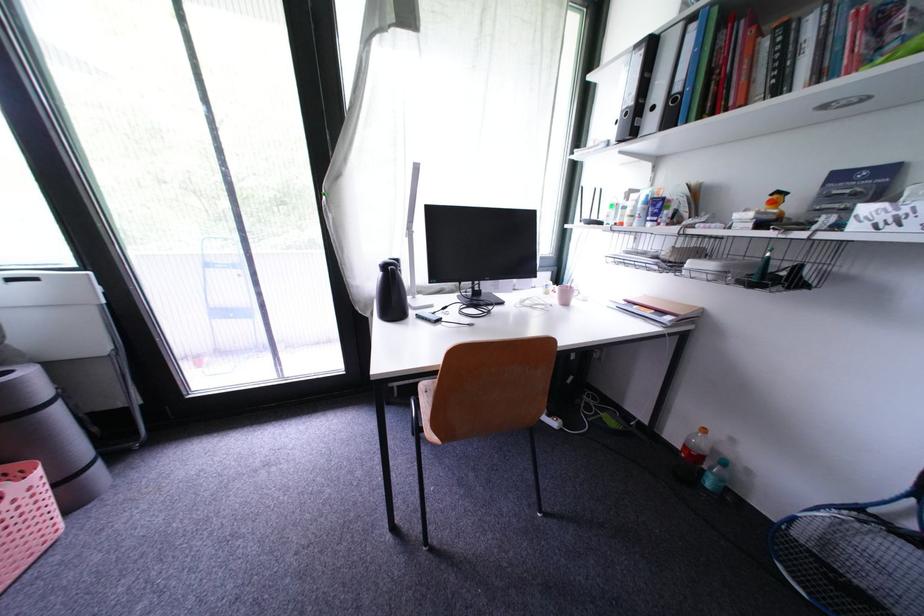
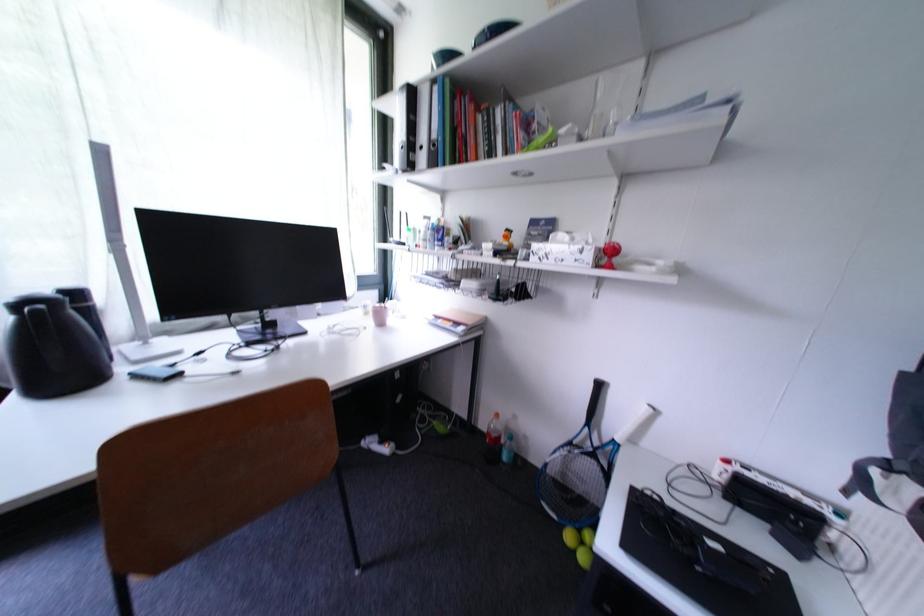
Locate, in the second image, the point that corresponds to point 697,442 in the first image.

(497, 429)